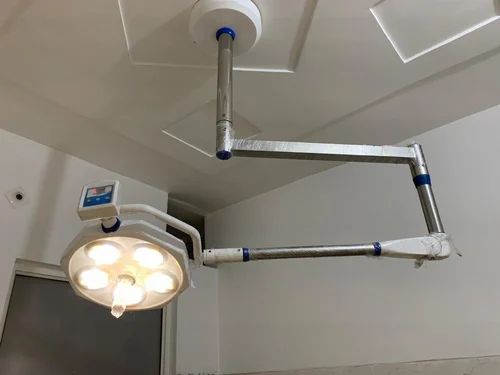
Identify the location of white wall. (303, 306), (49, 185).